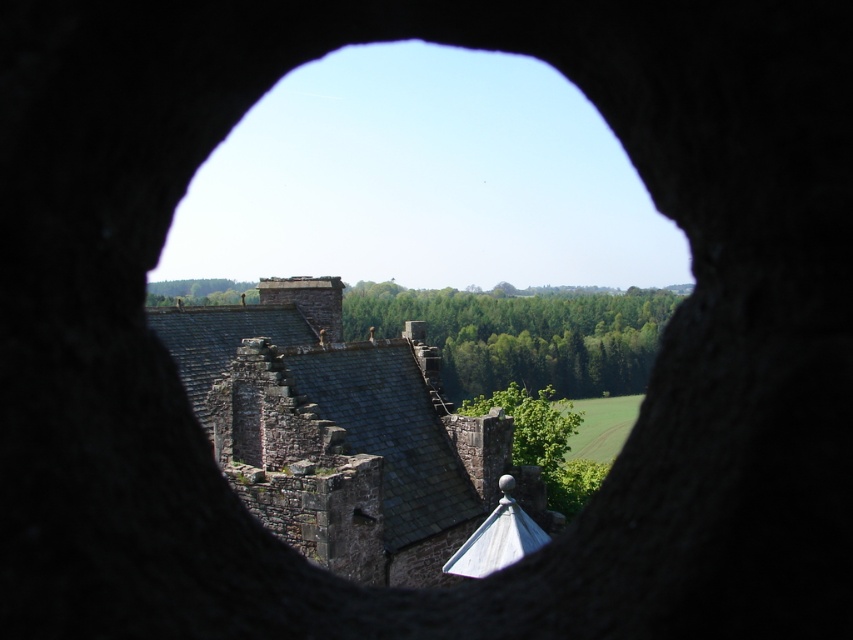
Question: Is green leafy trees at center smaller than green leafy tree at center?

Choices:
 (A) no
 (B) yes

Answer: (A)

Question: Is dark gray stone castle at center in front of green leafy tree at center?

Choices:
 (A) yes
 (B) no

Answer: (A)

Question: Does dark gray stone castle at center appear under green leafy tree at center?

Choices:
 (A) yes
 (B) no

Answer: (B)

Question: Considering the real-world distances, which object is closest to the green leafy trees at center?

Choices:
 (A) dark gray stone castle at center
 (B) green leafy tree at center

Answer: (B)

Question: Among these objects, which one is farthest from the camera?

Choices:
 (A) smooth stone window at center
 (B) dark gray stone castle at center
 (C) green leafy trees at center

Answer: (C)

Question: Among these points, which one is nearest to the camera?

Choices:
 (A) (357, 538)
 (B) (187, 339)
 (C) (558, 404)

Answer: (A)